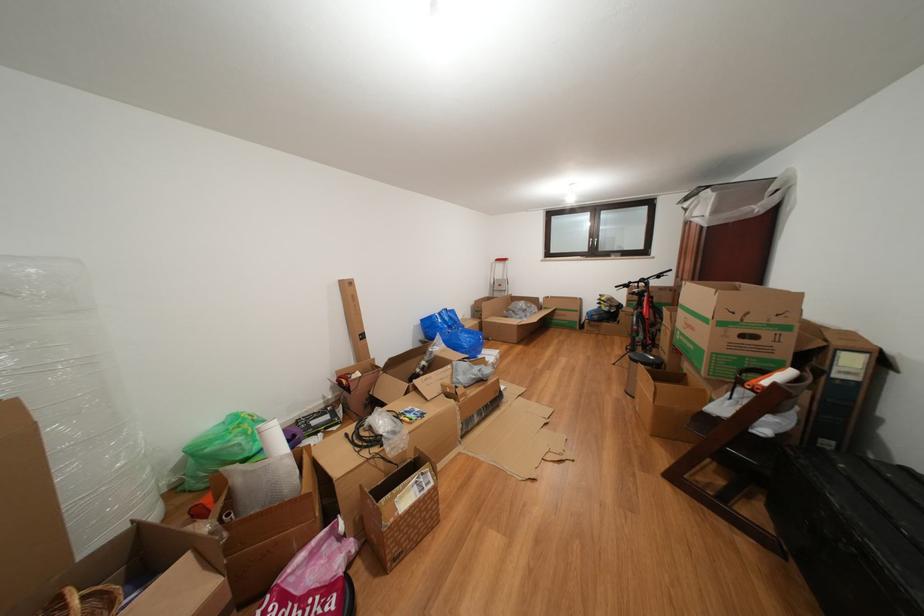
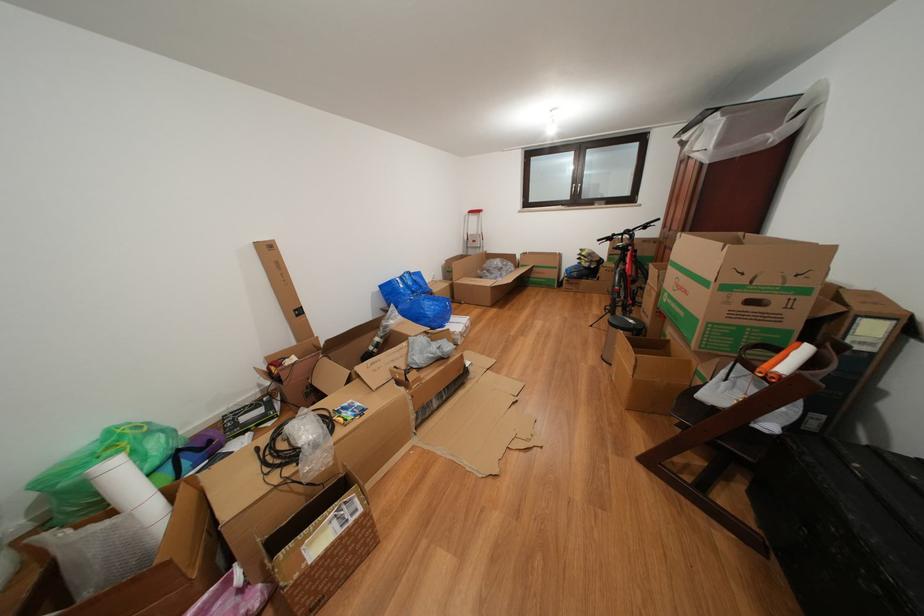
Find the pixel in the second image that matches the point at 773,378 in the first image.

(784, 355)